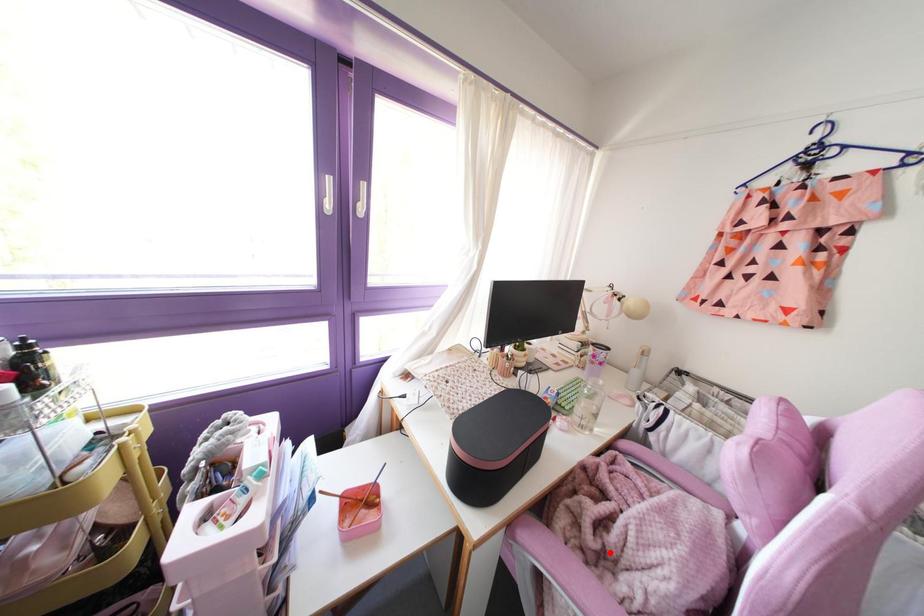
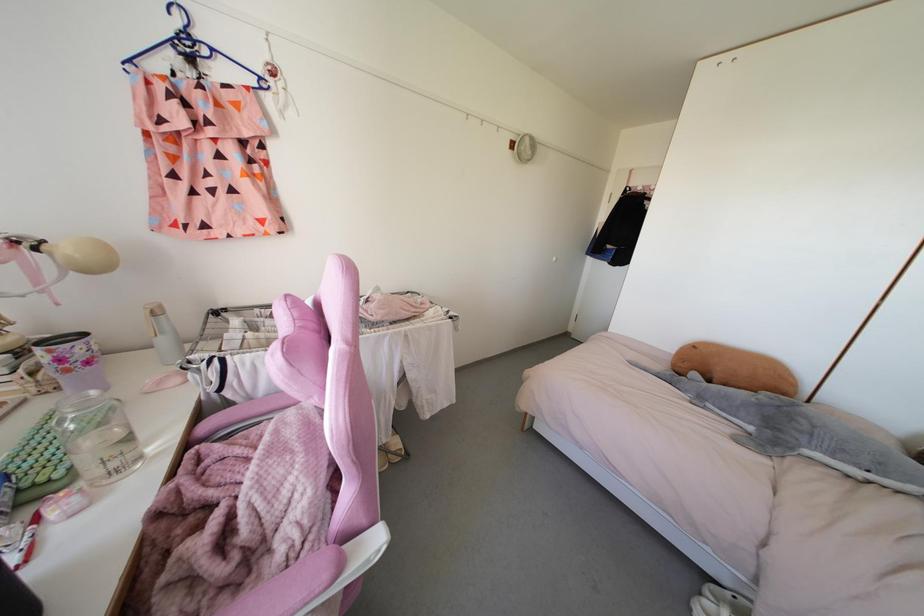
Question: I am providing you with two images of the same scene from different viewpoints. A red point is marked on the first image. Is the red point's position out of view in image 2?

Choices:
 (A) Yes
 (B) No

Answer: (B)